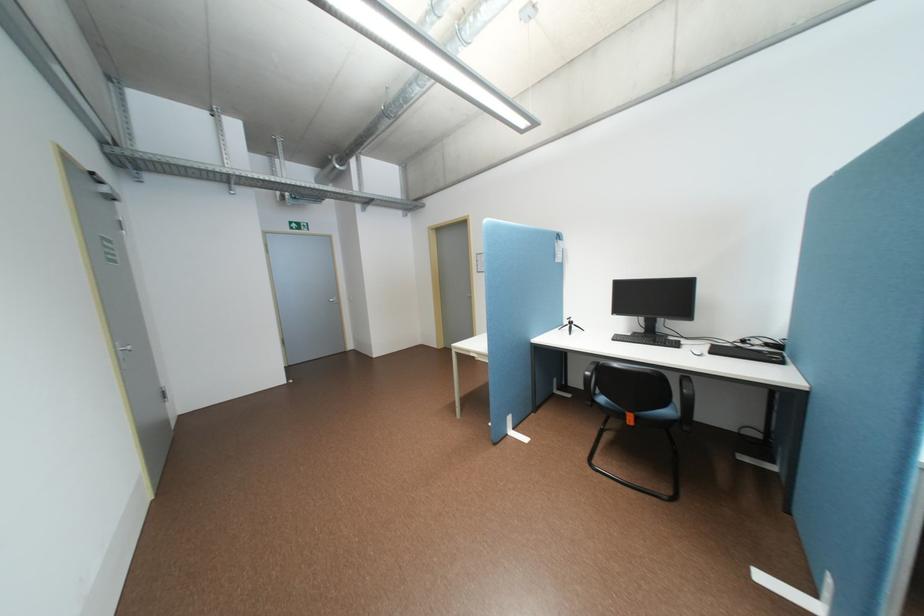
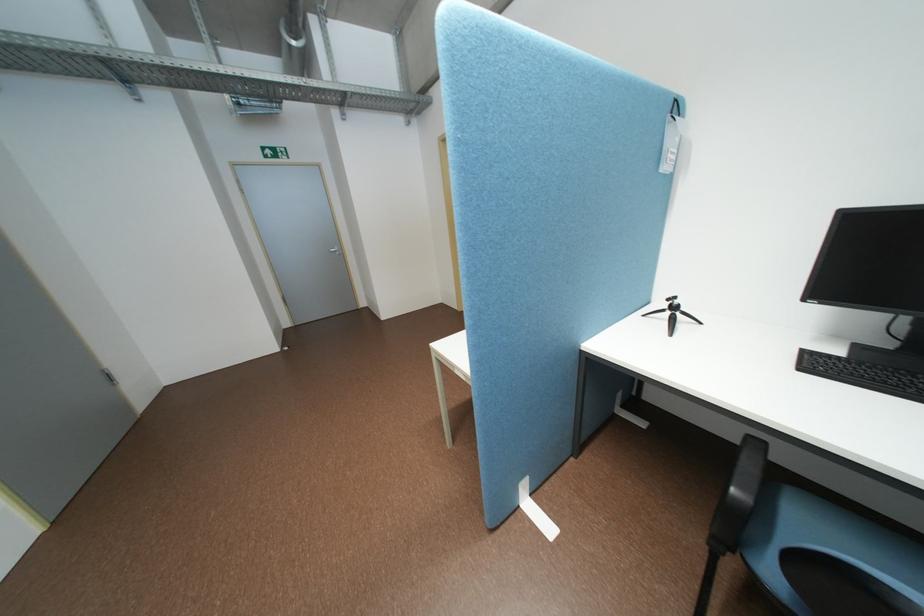
Question: Which direction would the cameraman need to move to produce the second image? Reply with the corresponding letter.

Choices:
 (A) Left
 (B) Right
 (C) Forward
 (D) Backward

Answer: (C)